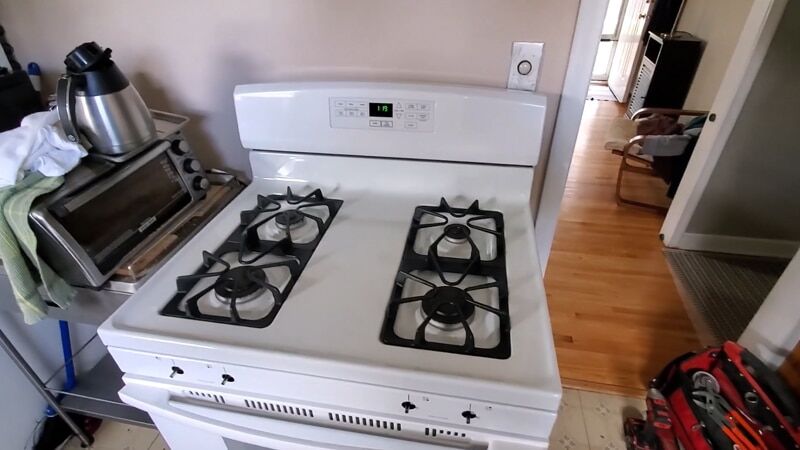
Where is `wall`? This screenshot has height=450, width=800. wall is located at coordinates (340, 43), (773, 197).